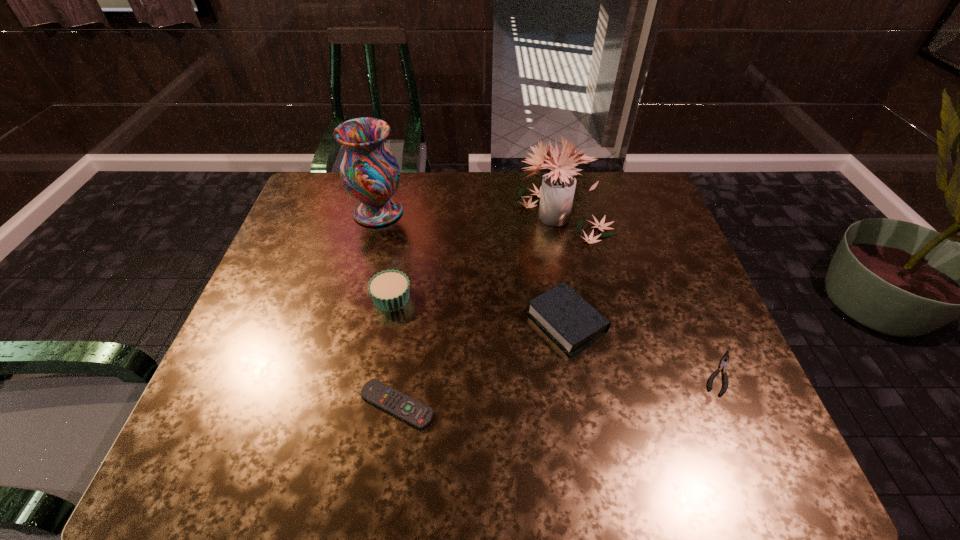
In the image, there is a desktop. Where is `vacant region at the left edge`? Image resolution: width=960 pixels, height=540 pixels. vacant region at the left edge is located at coordinates (246, 416).

At what (x,y) coordinates should I click in order to perform the action: click on free space at the far left corner of the desktop. Please return your answer as a coordinate pair (x, y). This screenshot has height=540, width=960. Looking at the image, I should click on (321, 215).

Locate an element on the screen. The width and height of the screenshot is (960, 540). free area in between the cupcake and the remote control is located at coordinates (395, 352).

Identify the location of unoccupied area between the bouquet and the shortest object. (641, 294).

Where is `vacant area that lies between the remote control and the shortest object`? This screenshot has width=960, height=540. vacant area that lies between the remote control and the shortest object is located at coordinates (559, 389).

The width and height of the screenshot is (960, 540). In order to click on free space between the pliers and the fourth tallest object in this screenshot , I will do `click(643, 348)`.

Find the location of a particular element. The width and height of the screenshot is (960, 540). free space between the rightmost object and the bouquet is located at coordinates (641, 294).

You are a GUI agent. You are given a task and a screenshot of the screen. Output one action in this format:
    pyautogui.click(x=<x>, y=<y>)
    Task: Click on the vacant region between the bouquet and the shortest object
    This screenshot has height=540, width=960.
    Given the screenshot: What is the action you would take?
    tap(641, 294)

Locate an element on the screen. free space between the Bible and the vase is located at coordinates (472, 267).

This screenshot has height=540, width=960. Find the location of `vacant area that lies between the third tallest object and the remote control`. vacant area that lies between the third tallest object and the remote control is located at coordinates pyautogui.click(x=395, y=352).